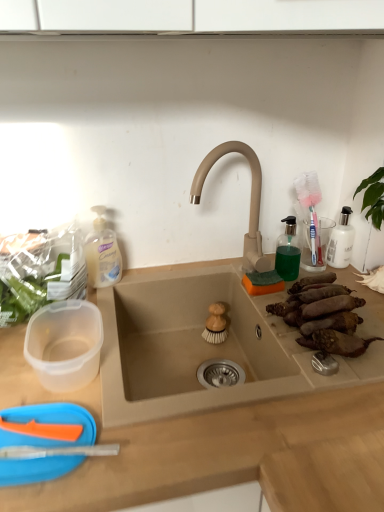
The width and height of the screenshot is (384, 512). I want to click on free location to the right of translucent plastic soap dispenser at left, so click(x=167, y=274).